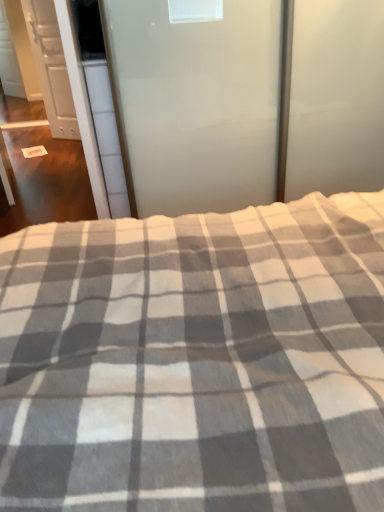
Question: Considering the positions of point (89, 169) and point (57, 101), is point (89, 169) closer or farther from the camera than point (57, 101)?

Choices:
 (A) closer
 (B) farther

Answer: (A)

Question: From the image's perspective, is white glossy door at upper left, acting as the second screen door starting from the right, above or below white matte cabinet at left?

Choices:
 (A) above
 (B) below

Answer: (B)

Question: Based on their relative distances, which object is nearer to the white matte cabinet at left?

Choices:
 (A) white glossy door at upper left, the 2th screen door viewed from the front
 (B) frosted glass screen door at upper center, which ranks as the second screen door in back-to-front order
 (C) gray checkered blanket at center

Answer: (A)

Question: Estimate the real-world distances between objects in this image. Which object is farther from the gray checkered blanket at center?

Choices:
 (A) frosted glass screen door at upper center, the second screen door from the left
 (B) white matte cabinet at left
 (C) white glossy door at upper left, acting as the second screen door starting from the right

Answer: (C)